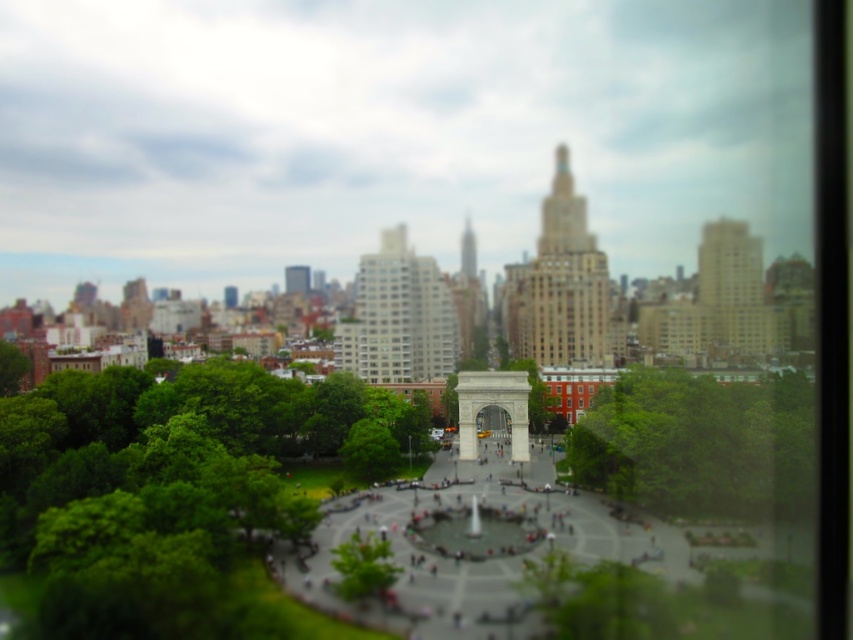
Does green leafy tree at lower left have a larger size compared to green leafy tree at center?

Indeed, green leafy tree at lower left has a larger size compared to green leafy tree at center.

The height and width of the screenshot is (640, 853). Describe the element at coordinates (160, 499) in the screenshot. I see `green leafy tree at lower left` at that location.

Identify the location of green leafy tree at lower left. The height and width of the screenshot is (640, 853). (160, 499).